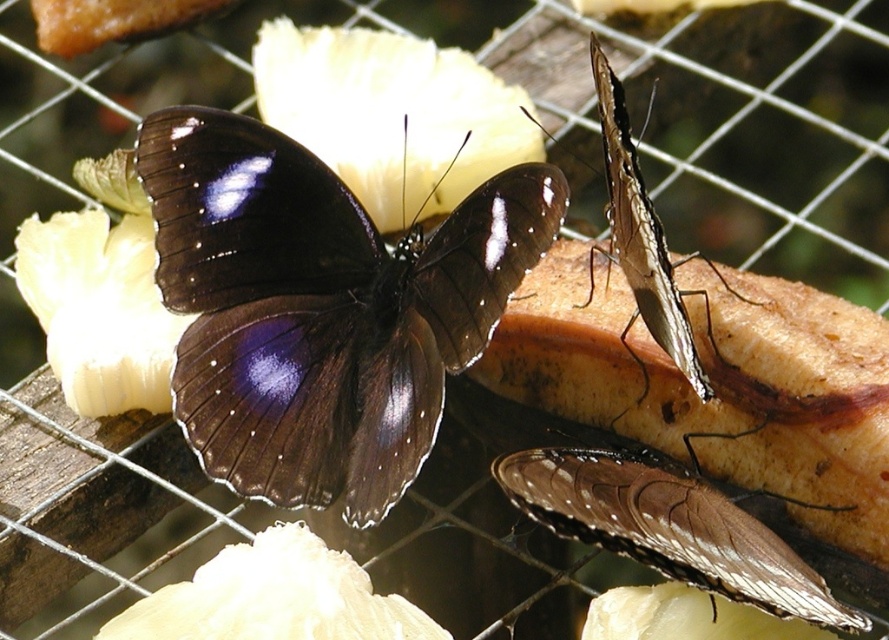
Between matte black butterfly at center and matte brown wing at center, which one has more height?

Standing taller between the two is matte black butterfly at center.

At what (x,y) coordinates should I click in order to perform the action: click on matte black butterfly at center. Please return your answer as a coordinate pair (x, y). The height and width of the screenshot is (640, 889). Looking at the image, I should click on (321, 307).

Does point (247, 140) come behind point (778, 556)?

Yes, point (247, 140) is behind point (778, 556).

The width and height of the screenshot is (889, 640). I want to click on matte black butterfly at center, so click(x=321, y=307).

Does matte black butterfly at center have a larger size compared to shiny brown butterfly at upper right?

Yes.

Is matte black butterfly at center positioned behind shiny brown butterfly at upper right?

Yes, matte black butterfly at center is further from the viewer.

Is point (282, 404) positioned after point (634, 168)?

Yes, point (282, 404) is farther from viewer.

Where is `matte black butterfly at center`? The height and width of the screenshot is (640, 889). matte black butterfly at center is located at coordinates (321, 307).

Can you confirm if matte brown wing at center is shorter than shiny brown butterfly at upper right?

Yes.

Who is more forward, (719, 513) or (649, 250)?

Point (649, 250) is in front.

Where is `matte brown wing at center`? This screenshot has width=889, height=640. matte brown wing at center is located at coordinates (669, 528).